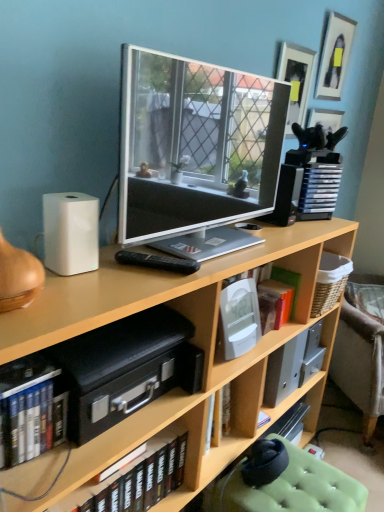
Locate an element on the screen. Image resolution: width=384 pixels, height=512 pixels. free spot to the right of white matte speaker at left, acting as the second speaker starting from the right is located at coordinates (133, 277).